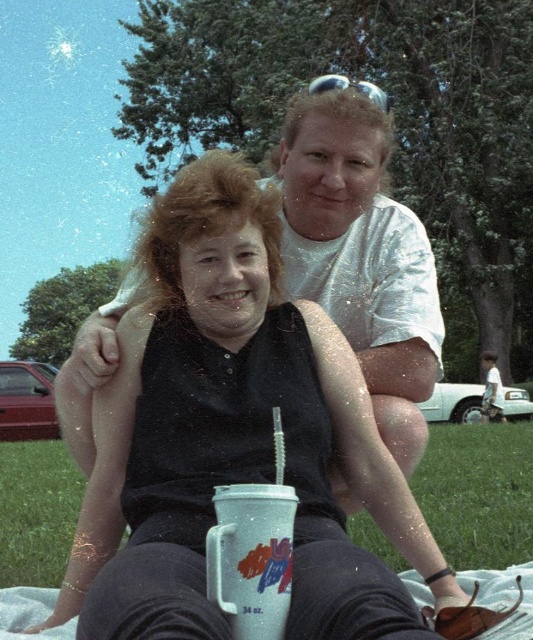
Question: Does green grass at lower center lie behind white plastic mug at center?

Choices:
 (A) no
 (B) yes

Answer: (B)

Question: Is green grass at lower center above white plastic mug at center?

Choices:
 (A) no
 (B) yes

Answer: (A)

Question: Which point is farther from the camera taking this photo?

Choices:
 (A) (515, 451)
 (B) (214, 586)

Answer: (A)

Question: Which of the following is the closest to the observer?

Choices:
 (A) green grass at lower center
 (B) white plastic mug at center

Answer: (B)

Question: Is green grass at lower center to the left of white plastic mug at center from the viewer's perspective?

Choices:
 (A) no
 (B) yes

Answer: (B)